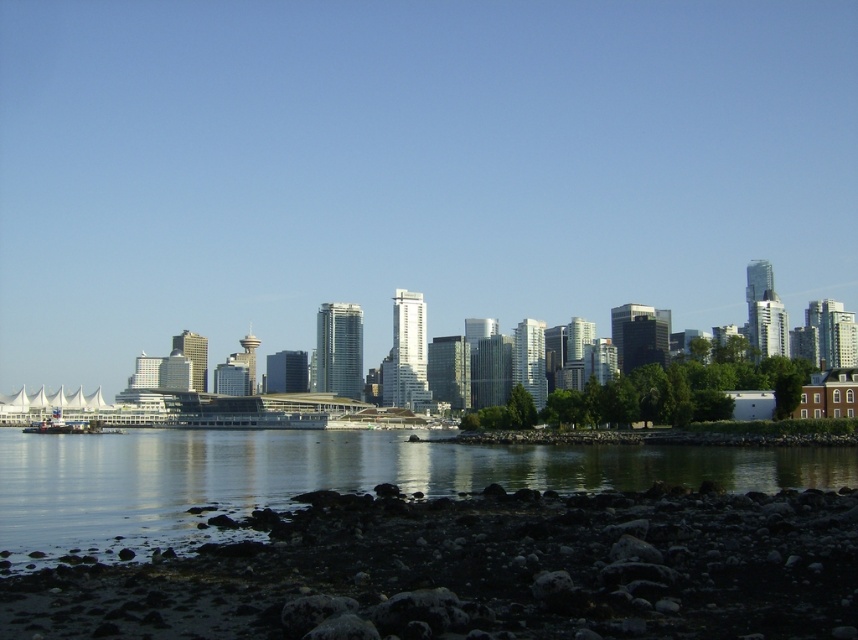
Which of these two, dark gray rocky shore at lower left or smooth dark water at lower center, stands shorter?

dark gray rocky shore at lower left

Which of these two, dark gray rocky shore at lower left or smooth dark water at lower center, stands taller?

smooth dark water at lower center is taller.

Where is `dark gray rocky shore at lower left`? Image resolution: width=858 pixels, height=640 pixels. dark gray rocky shore at lower left is located at coordinates (479, 572).